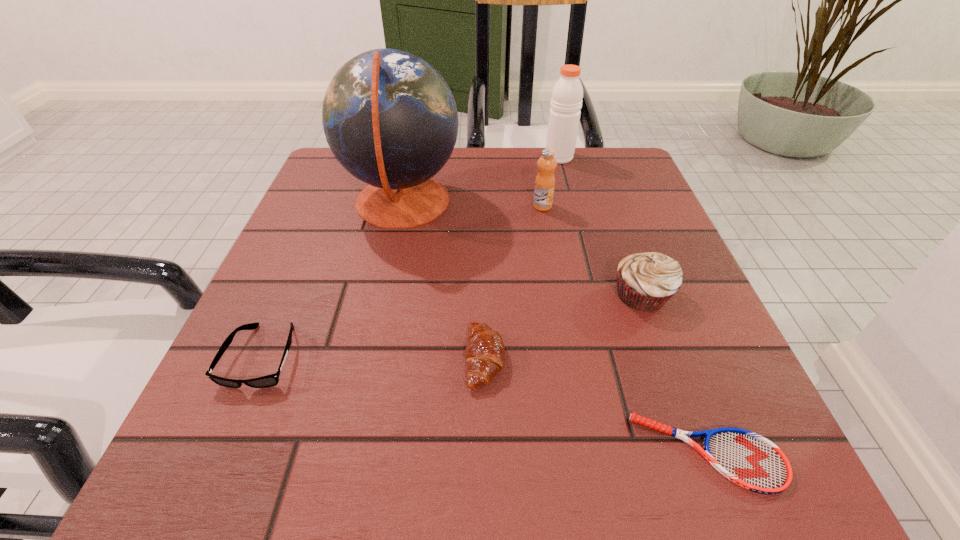
Find the location of a particular element. This screenshot has width=960, height=540. object at the near right corner is located at coordinates (748, 459).

This screenshot has height=540, width=960. In the image, there is a desktop. Find the location of `vacant space at the far edge`. vacant space at the far edge is located at coordinates (481, 173).

Locate an element on the screen. blank area at the near edge is located at coordinates (380, 444).

Where is `vacant space at the left edge of the desktop`? vacant space at the left edge of the desktop is located at coordinates [244, 398].

At what (x,y) coordinates should I click in order to perform the action: click on free space at the right edge of the desktop. Please return your answer as a coordinate pair (x, y). Looking at the image, I should click on (690, 279).

Locate an element on the screen. vacant area at the far left corner is located at coordinates (337, 193).

Identify the location of vacant space at the near left corner of the desktop. This screenshot has height=540, width=960. (264, 441).

The image size is (960, 540). In order to click on vacant space at the far right corner of the desktop in this screenshot , I will do `click(627, 164)`.

You are a GUI agent. You are given a task and a screenshot of the screen. Output one action in this format:
    pyautogui.click(x=<x>, y=<y>)
    Task: Click on the vacant area between the tallest object and the second tallest object
    The height and width of the screenshot is (540, 960).
    Given the screenshot: What is the action you would take?
    pyautogui.click(x=481, y=180)

Locate an element on the screen. Image resolution: width=960 pixels, height=540 pixels. vacant space that is in between the muffin and the nearest object is located at coordinates (675, 373).